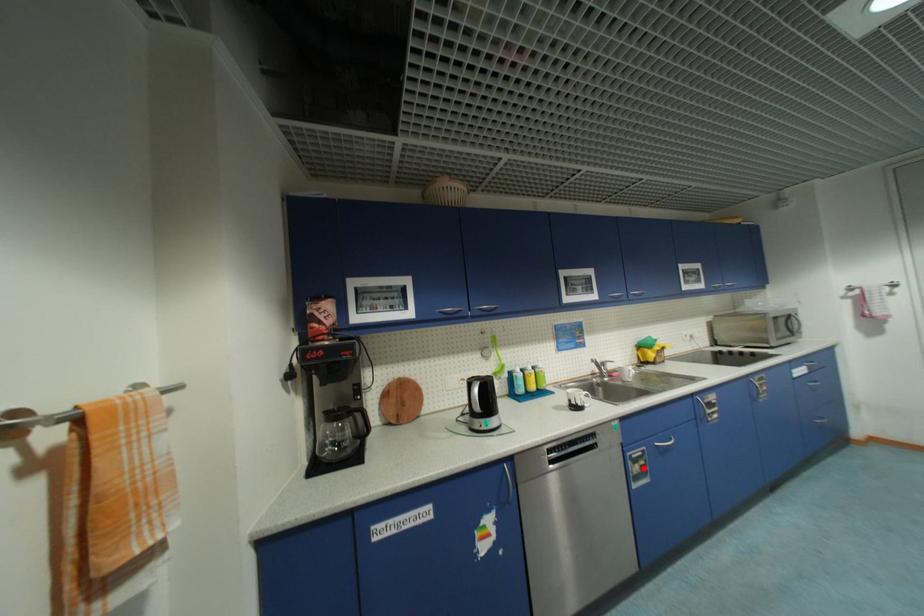
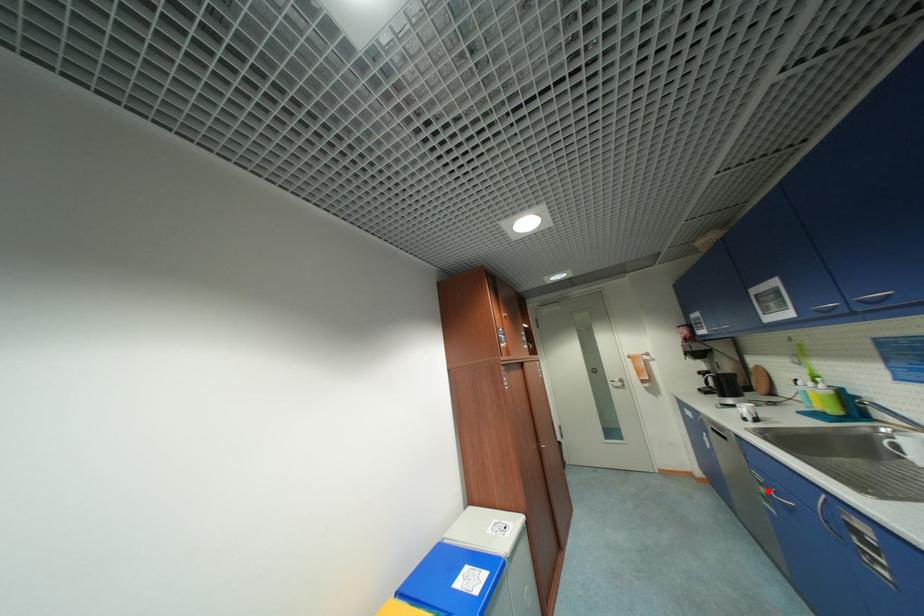
I am providing you with two images of the same scene from different viewpoints. A red point is marked on the first image and another point is marked on the second image. Does the point marked in image1 correspond to the same location as the one in image2?

Yes